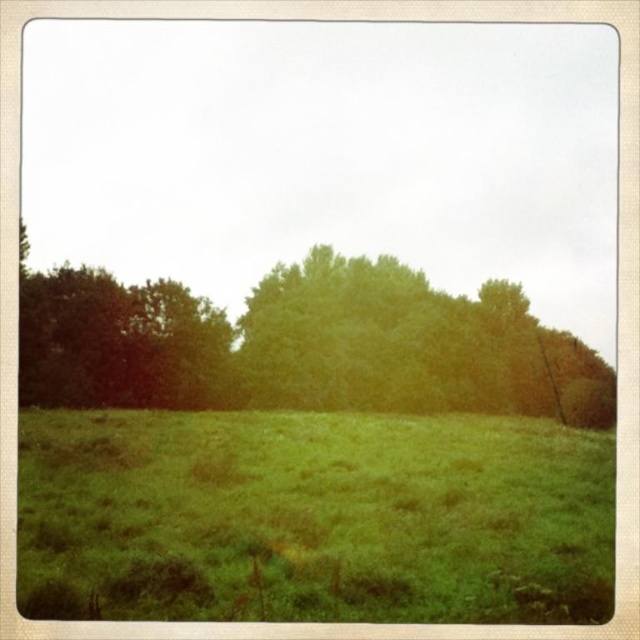
Question: Considering the relative positions of green grassy field at center and green leafy tree at center in the image provided, where is green grassy field at center located with respect to green leafy tree at center?

Choices:
 (A) above
 (B) below

Answer: (B)

Question: Observing the image, what is the correct spatial positioning of green grassy field at center in reference to green leafy tree at center?

Choices:
 (A) right
 (B) left

Answer: (A)

Question: Is green grassy field at center positioned behind green leafy tree at center?

Choices:
 (A) yes
 (B) no

Answer: (B)

Question: Which object is farther from the camera taking this photo?

Choices:
 (A) green grassy field at center
 (B) green leafy tree at center

Answer: (B)